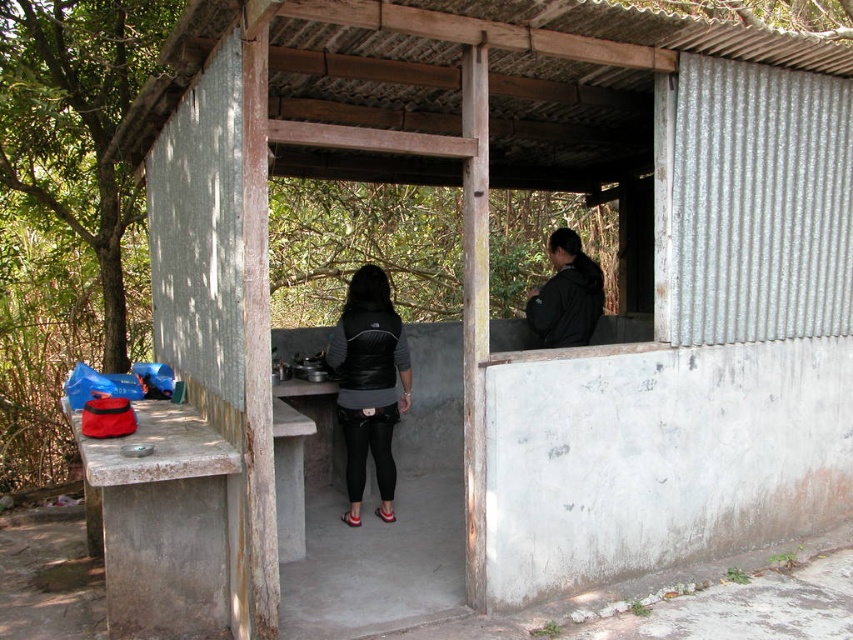
Does black matte vest at center have a lesser height compared to black matte jacket at upper right?

No.

Does black matte vest at center come behind black matte jacket at upper right?

No.

Locate an element on the screen. The image size is (853, 640). black matte vest at center is located at coordinates (369, 385).